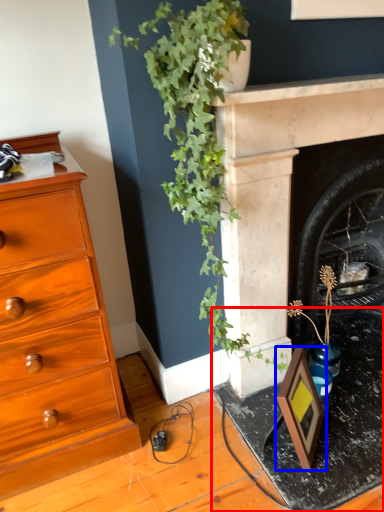
Question: Among these objects, which one is nearest to the camera, table (highlighted by a red box) or picture frame (highlighted by a blue box)?

Choices:
 (A) table
 (B) picture frame

Answer: (A)